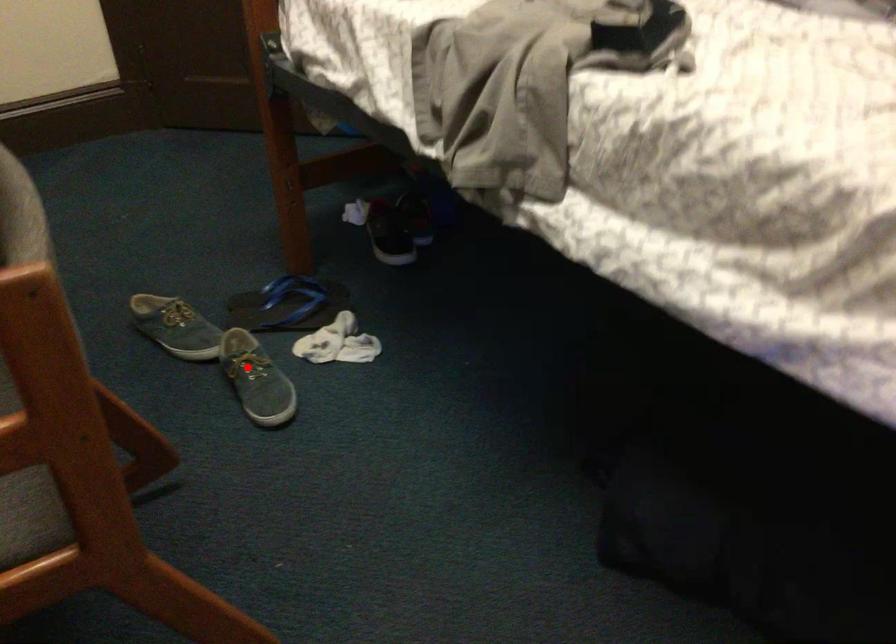
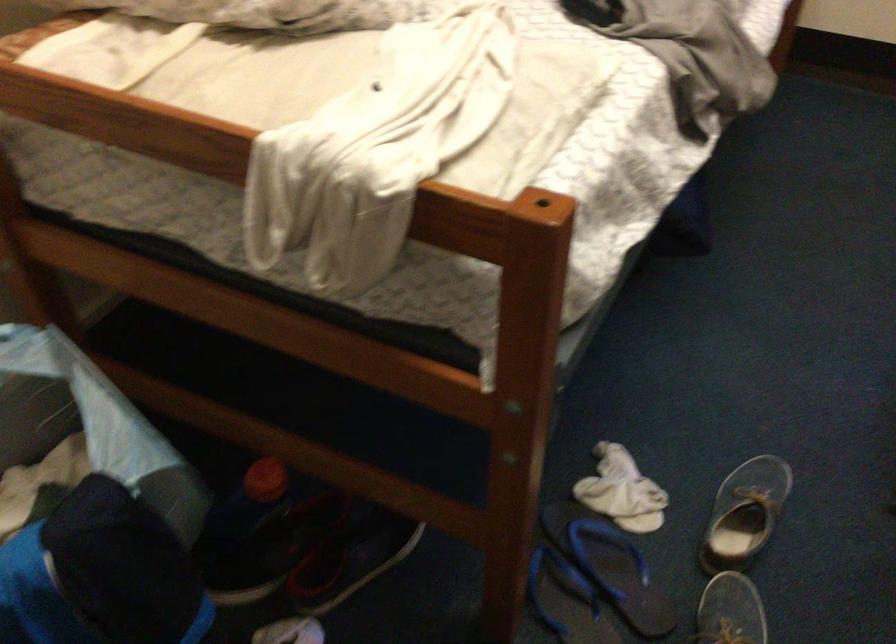
Where in the second image is the point corresponding to the highlighted location from the first image?

(745, 514)